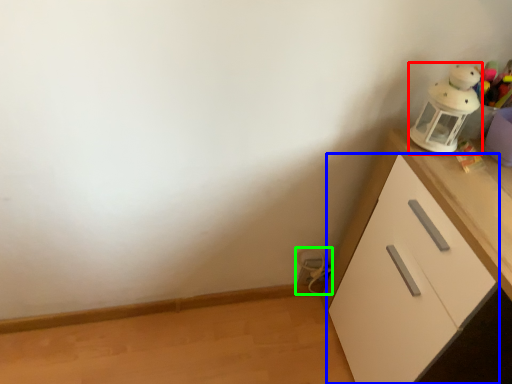
Question: Which is nearer to the toy (highlighted by a red box)? cabinetry (highlighted by a blue box) or toy (highlighted by a green box).

Choices:
 (A) cabinetry
 (B) toy

Answer: (A)